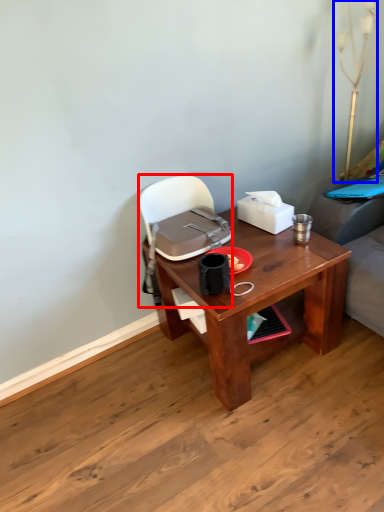
Question: Which object is further to the camera taking this photo, handbag (highlighted by a red box) or table lamp (highlighted by a blue box)?

Choices:
 (A) handbag
 (B) table lamp

Answer: (B)